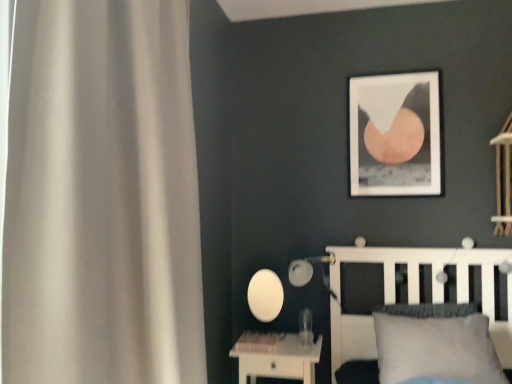
Question: Are white matte bed at lower right and white matte curtain at left beside each other?

Choices:
 (A) yes
 (B) no

Answer: (B)

Question: Can you confirm if white matte bed at lower right is thinner than white matte curtain at left?

Choices:
 (A) yes
 (B) no

Answer: (B)

Question: From a real-world perspective, is white matte bed at lower right on white matte curtain at left?

Choices:
 (A) yes
 (B) no

Answer: (B)

Question: Can you confirm if white matte bed at lower right is wider than white matte curtain at left?

Choices:
 (A) yes
 (B) no

Answer: (A)

Question: Does white matte bed at lower right have a larger size compared to white matte curtain at left?

Choices:
 (A) yes
 (B) no

Answer: (A)

Question: Which is correct: white soft pillow at lower right is inside matte white table lamp at center, or outside of it?

Choices:
 (A) outside
 (B) inside

Answer: (A)

Question: In the image, is white soft pillow at lower right on the left side or the right side of matte white table lamp at center?

Choices:
 (A) left
 (B) right

Answer: (B)

Question: From the image's perspective, relative to matte white table lamp at center, is white soft pillow at lower right above or below?

Choices:
 (A) below
 (B) above

Answer: (A)

Question: In terms of width, does white soft pillow at lower right look wider or thinner when compared to matte white table lamp at center?

Choices:
 (A) thin
 (B) wide

Answer: (B)

Question: From a real-world perspective, relative to white matte curtain at left, is white glossy nightstand at lower center vertically above or below?

Choices:
 (A) above
 (B) below

Answer: (B)

Question: In the image, is white glossy nightstand at lower center on the left side or the right side of white matte curtain at left?

Choices:
 (A) left
 (B) right

Answer: (B)

Question: Considering the positions of point (259, 362) and point (116, 87), is point (259, 362) closer or farther from the camera than point (116, 87)?

Choices:
 (A) farther
 (B) closer

Answer: (A)

Question: Looking at their shapes, would you say white glossy nightstand at lower center is wider or thinner than white matte curtain at left?

Choices:
 (A) wide
 (B) thin

Answer: (A)

Question: Is point tap(446, 292) closer or farther from the camera than point tap(313, 370)?

Choices:
 (A) farther
 (B) closer

Answer: (A)

Question: From the image's perspective, is white matte bed at lower right above or below white glossy nightstand at lower center?

Choices:
 (A) below
 (B) above

Answer: (B)